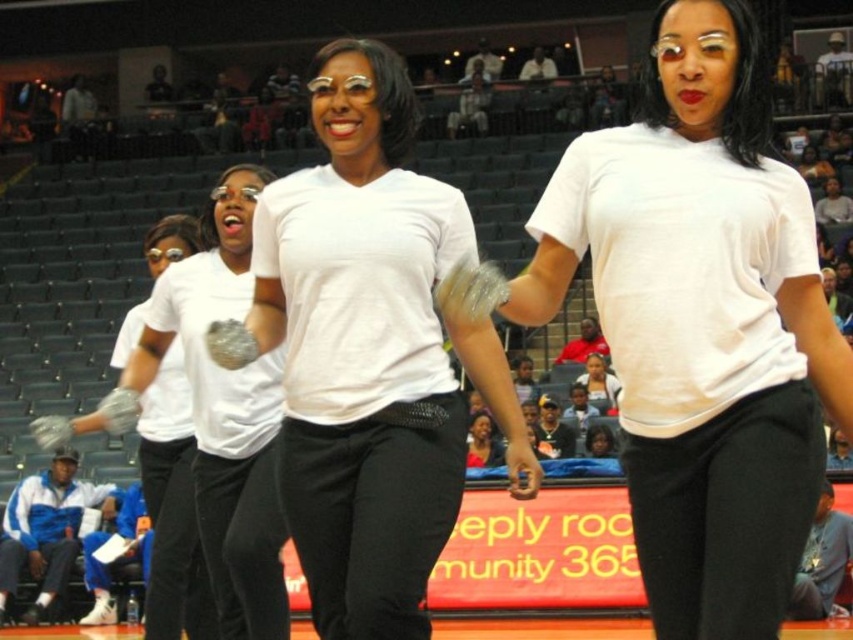
Between white matte shirt at center and white matte glove at center, which one is positioned higher?

Positioned higher is white matte shirt at center.

Between white matte shirt at center and white matte glove at center, which one has less height?

white matte glove at center

You are a GUI agent. You are given a task and a screenshot of the screen. Output one action in this format:
    pyautogui.click(x=<x>, y=<y>)
    Task: Click on the white matte shirt at center
    The height and width of the screenshot is (640, 853).
    Given the screenshot: What is the action you would take?
    pyautogui.click(x=360, y=349)

This screenshot has width=853, height=640. I want to click on white matte shirt at center, so click(360, 349).

Does white matte t-shirt at center have a lesser width compared to white matte glove at center?

Yes, white matte t-shirt at center is thinner than white matte glove at center.

Is white matte t-shirt at center shorter than white matte glove at center?

Yes, white matte t-shirt at center is shorter than white matte glove at center.

Is point (647, 493) in front of point (219, 214)?

Yes.

At what (x,y) coordinates should I click in order to perform the action: click on white matte t-shirt at center. Please return your answer as a coordinate pair (x, y). Image resolution: width=853 pixels, height=640 pixels. Looking at the image, I should click on click(695, 323).

Is white matte t-shirt at center thinner than white matte gloves at center?

Yes, white matte t-shirt at center is thinner than white matte gloves at center.

Does point (459, 268) come closer to viewer compared to point (163, 387)?

Yes, point (459, 268) is closer to viewer.

Does point (693, 202) come closer to viewer compared to point (148, 593)?

Yes, it is in front of point (148, 593).

Where is `white matte t-shirt at center`? This screenshot has width=853, height=640. white matte t-shirt at center is located at coordinates (695, 323).